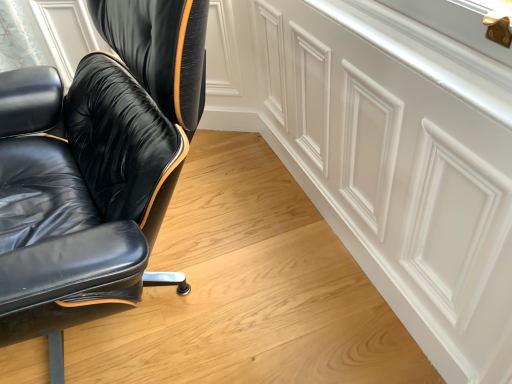
Question: From a real-world perspective, does white matte cabinetry at upper right stand above black leather chair at left?

Choices:
 (A) no
 (B) yes

Answer: (A)

Question: Is white matte cabinetry at upper right to the right of black leather chair at left from the viewer's perspective?

Choices:
 (A) no
 (B) yes

Answer: (B)

Question: Can you confirm if white matte cabinetry at upper right is wider than black leather chair at left?

Choices:
 (A) no
 (B) yes

Answer: (A)

Question: Would you say white matte cabinetry at upper right contains black leather chair at left?

Choices:
 (A) no
 (B) yes

Answer: (A)

Question: Is white matte cabinetry at upper right oriented towards black leather chair at left?

Choices:
 (A) yes
 (B) no

Answer: (A)

Question: Considering the relative positions of white matte cabinetry at upper right and black leather chair at left in the image provided, is white matte cabinetry at upper right in front of black leather chair at left?

Choices:
 (A) yes
 (B) no

Answer: (B)

Question: Could you tell me if black leather chair at left is turned towards white matte cabinetry at upper right?

Choices:
 (A) no
 (B) yes

Answer: (A)

Question: Would you consider black leather chair at left to be distant from white matte cabinetry at upper right?

Choices:
 (A) no
 (B) yes

Answer: (A)

Question: Does black leather chair at left come in front of white matte cabinetry at upper right?

Choices:
 (A) no
 (B) yes

Answer: (B)

Question: Can you confirm if black leather chair at left is taller than white matte cabinetry at upper right?

Choices:
 (A) yes
 (B) no

Answer: (A)

Question: Is black leather chair at left wider than white matte cabinetry at upper right?

Choices:
 (A) yes
 (B) no

Answer: (A)

Question: From a real-world perspective, does black leather chair at left sit lower than white matte cabinetry at upper right?

Choices:
 (A) yes
 (B) no

Answer: (B)

Question: Is white matte cabinetry at upper right taller or shorter than black leather chair at left?

Choices:
 (A) tall
 (B) short

Answer: (B)